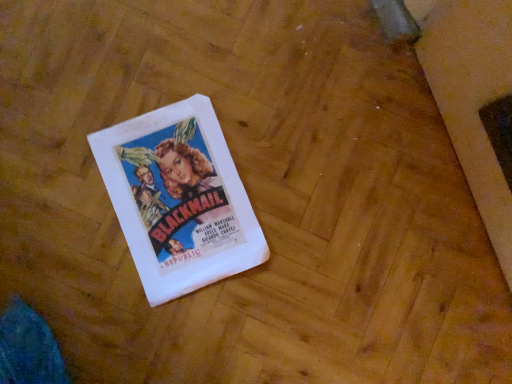
Identify the location of free location above white paper poster at center (from a real-world perspective). Image resolution: width=512 pixels, height=384 pixels. (177, 198).